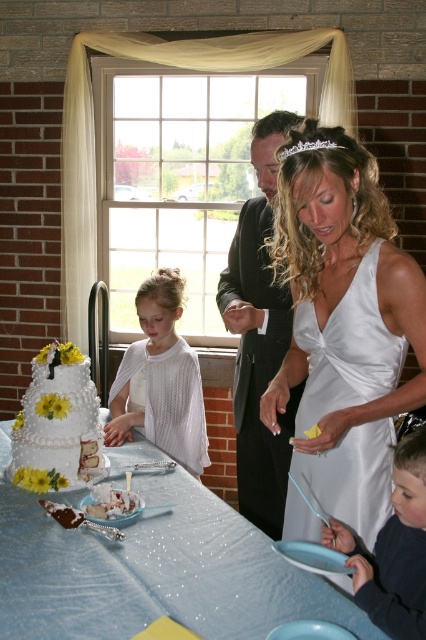
Question: Can you confirm if white glittery tablecloth at center is positioned above white satin dress at center?

Choices:
 (A) no
 (B) yes

Answer: (A)

Question: Which object appears farthest from the camera in this image?

Choices:
 (A) smooth blue shirt at lower right
 (B) white satin dress at center
 (C) white textured cake at center
 (D) white glittery tablecloth at center

Answer: (C)

Question: Can you confirm if white glittery tablecloth at center is positioned to the right of smooth blue shirt at lower right?

Choices:
 (A) no
 (B) yes

Answer: (A)

Question: In this image, where is white glittery tablecloth at center located relative to black satin suit at center?

Choices:
 (A) below
 (B) above

Answer: (A)

Question: Which point appears farthest from the camera in this image?

Choices:
 (A) (282, 337)
 (B) (58, 465)
 (C) (391, 344)

Answer: (A)

Question: Which object appears farthest from the camera in this image?

Choices:
 (A) black satin suit at center
 (B) white glittery tablecloth at center
 (C) white satin dress at center

Answer: (A)